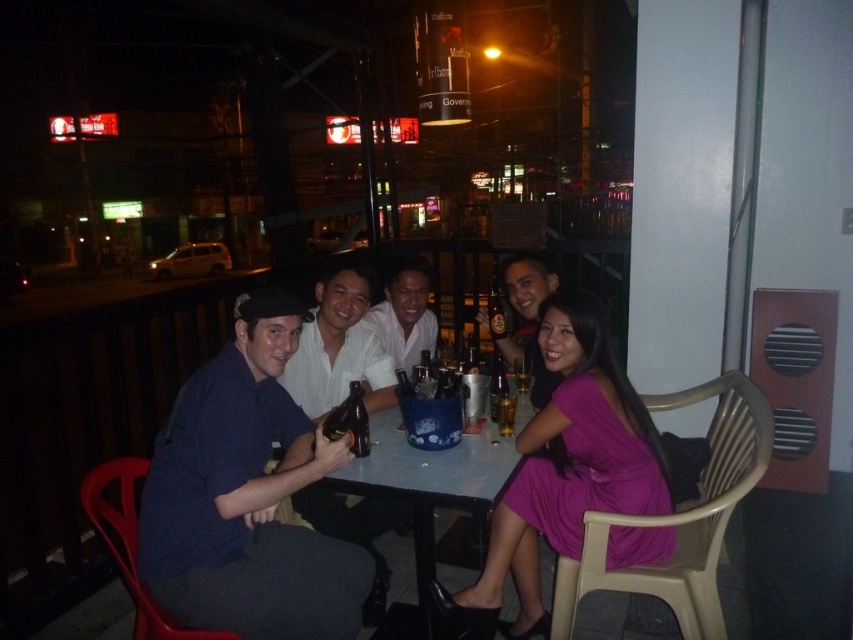
Question: Which object appears farthest from the camera in this image?

Choices:
 (A) dark blue shirt at center
 (B) dark blue shirt at left

Answer: (A)

Question: Observing the image, what is the correct spatial positioning of dark blue shirt at left in reference to pink satin dress at center?

Choices:
 (A) above
 (B) below

Answer: (A)

Question: Is brown glass bottle at table center positioned at the back of translucent glass beer at table center?

Choices:
 (A) no
 (B) yes

Answer: (A)

Question: Among these points, which one is farthest from the camera?

Choices:
 (A) (534, 580)
 (B) (515, 380)
 (C) (497, 292)

Answer: (C)

Question: Estimate the real-world distances between objects in this image. Which object is farther from the translucent glass beer at table center?

Choices:
 (A) translucent plastic bottle at center
 (B) white matte shirt at center

Answer: (B)

Question: Does blue plastic table at center have a larger size compared to brown glass bottle at table center?

Choices:
 (A) yes
 (B) no

Answer: (A)